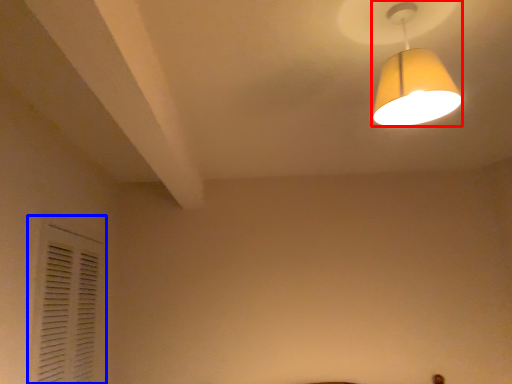
Question: Which object appears closest to the camera in this image, lamp (highlighted by a red box) or shutter (highlighted by a blue box)?

Choices:
 (A) lamp
 (B) shutter

Answer: (A)